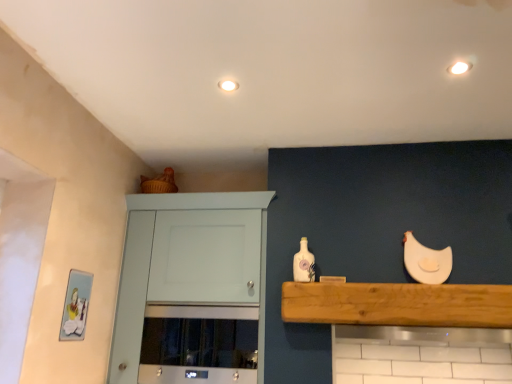
Question: Looking at their shapes, would you say white matte chicken at upper right is wider or thinner than white glossy light fixture at upper right, acting as the 1th lighting starting from the front?

Choices:
 (A) thin
 (B) wide

Answer: (A)

Question: Considering the positions of white matte chicken at upper right and white glossy light fixture at upper right, placed as the first lighting when sorted from right to left, in the image, is white matte chicken at upper right bigger or smaller than white glossy light fixture at upper right, placed as the first lighting when sorted from right to left,?

Choices:
 (A) big
 (B) small

Answer: (A)

Question: Which is farther from the white matte chicken at upper right?

Choices:
 (A) wooden at upper center
 (B) white glossy light fixture at upper right, positioned as the 2th lighting in left-to-right order
 (C) satin silver oven at center
 (D) white painted wood cabinet at upper left
 (E) white glossy bottle at center

Answer: (D)

Question: Estimate the real-world distances between objects in this image. Which object is farther from the white painted wood cabinet at upper left?

Choices:
 (A) white matte chicken at upper right
 (B) white glossy bottle at center
 (C) wooden at upper center
 (D) white matte light fixture at upper center, the 1th lighting viewed from the left
 (E) white glossy light fixture at upper right, positioned as the 2th lighting in left-to-right order

Answer: (E)